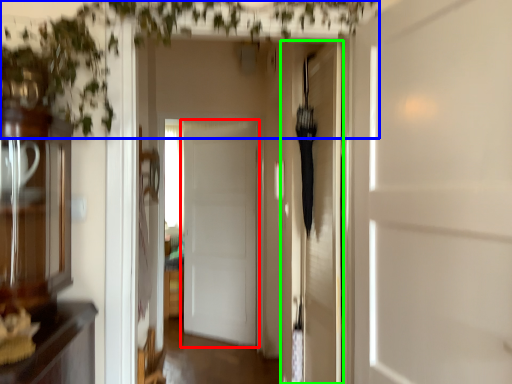
Question: Which object is the farthest from door (highlighted by a red box)? Choose among these: vegetation (highlighted by a blue box) or door (highlighted by a green box).

Choices:
 (A) vegetation
 (B) door

Answer: (A)